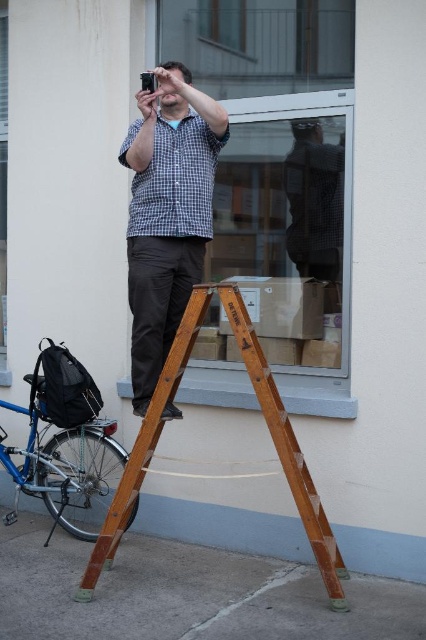
Question: Among these objects, which one is nearest to the camera?

Choices:
 (A) checkered fabric shirt at center
 (B) transparent glass window at upper center
 (C) blue metallic bicycle at lower left
 (D) checkered fabric shirt at upper center

Answer: (A)

Question: Which point is closer to the camera taking this photo?

Choices:
 (A) 89,564
 (B) 221,140
 (C) 325,83

Answer: (A)

Question: Can you confirm if checkered fabric shirt at center is wider than wooden at center?

Choices:
 (A) no
 (B) yes

Answer: (A)

Question: Which object is the closest to the wooden at center?

Choices:
 (A) blue metallic bicycle at lower left
 (B) checkered fabric shirt at upper center
 (C) transparent glass window at upper center

Answer: (A)

Question: Does checkered fabric shirt at center appear on the right side of blue metallic bicycle at lower left?

Choices:
 (A) yes
 (B) no

Answer: (A)

Question: From the image, what is the correct spatial relationship of transparent glass window at upper center in relation to checkered fabric shirt at center?

Choices:
 (A) below
 (B) above

Answer: (B)